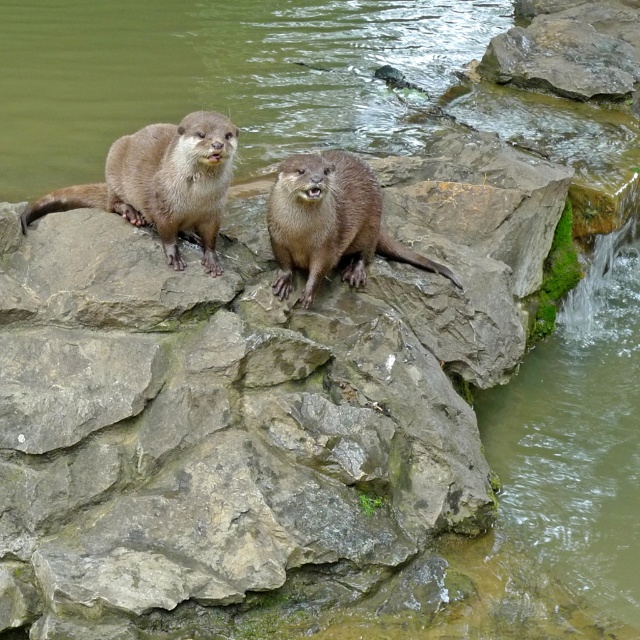
Can you confirm if brown furry otter at upper left is positioned to the left of brown furry otter at center?

Indeed, brown furry otter at upper left is positioned on the left side of brown furry otter at center.

Measure the distance between brown furry otter at upper left and camera.

brown furry otter at upper left is 12.70 feet from camera.

This screenshot has height=640, width=640. I want to click on brown furry otter at upper left, so click(x=161, y=182).